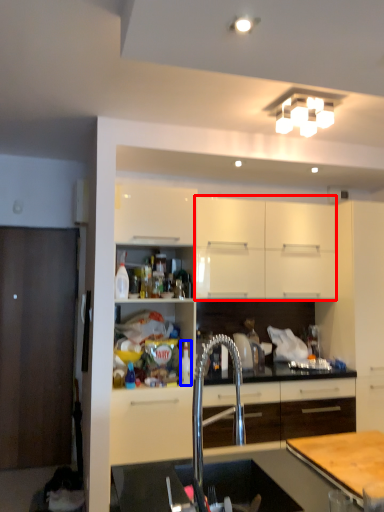
Question: Which object appears closest to the camera in this image, cabinetry (highlighted by a red box) or bottle (highlighted by a blue box)?

Choices:
 (A) cabinetry
 (B) bottle

Answer: (B)